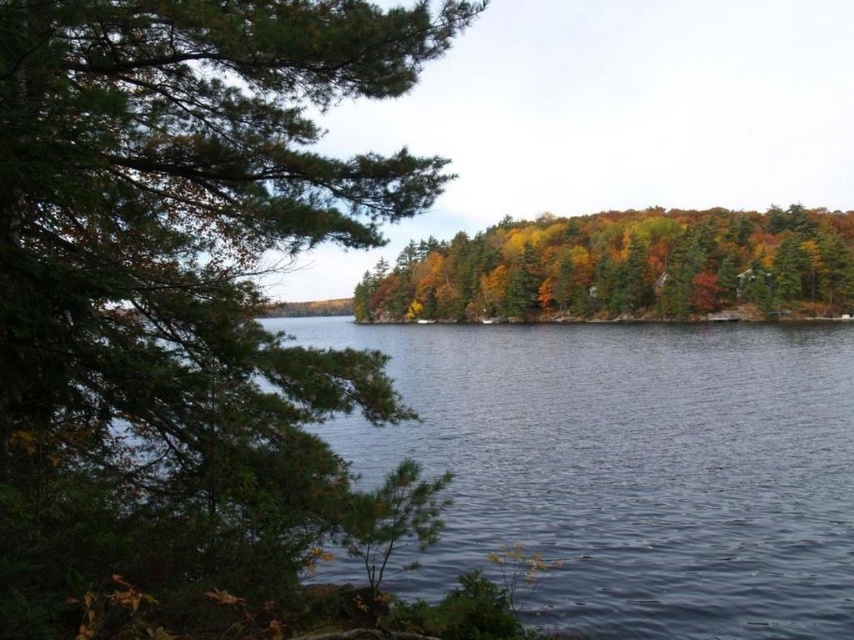
In the scene shown: You are standing at the lakeside and want to take a photo of the green matte tree at left. If your camera has a maximum focus range of 15 feet, will it be able to capture the tree clearly?

The green matte tree at left is 15.12 feet away from the viewer. Since the camera can only focus up to 15 feet, it will be slightly out of range, resulting in a blurry image.

Looking at this image, you are a painter setting up your easel to capture the lakeside scene. You want to ensure that the green matte tree at left and the autumn leaves at center are both visible in your painting. Given their sizes, which object should you place closer to the foreground to maintain their visibility?

The green matte tree at left is smaller than autumn leaves at center. To maintain visibility of both, place the smaller green matte tree at left closer to the foreground so its size in the painting matches the larger autumn leaves at center.